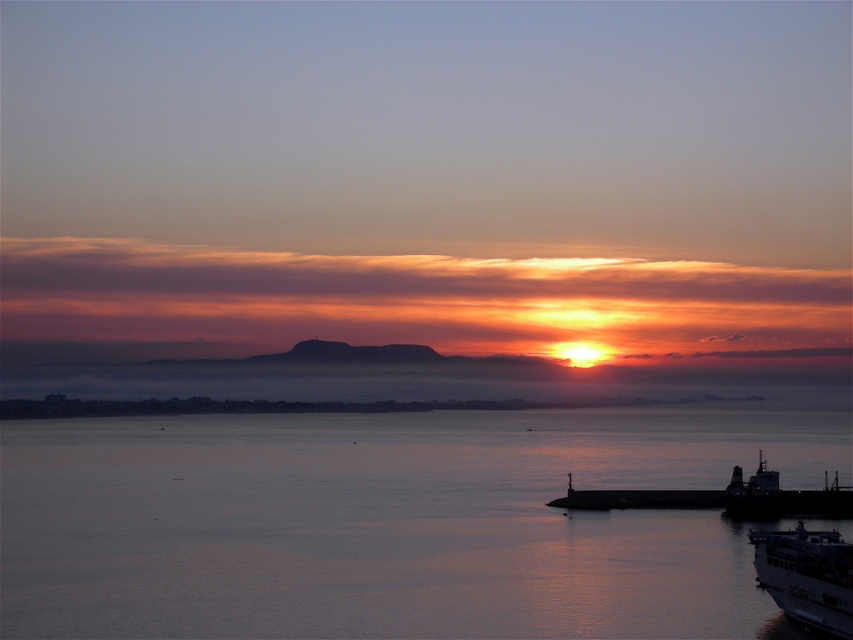
Between point (815, 616) and point (851, 493), which one is positioned behind?

The point (851, 493) is more distant.

Does white glossy boat at lower right appear over silvery metallic boat at lower right?

Correct, white glossy boat at lower right is located above silvery metallic boat at lower right.

Identify the location of white glossy boat at lower right. (805, 577).

I want to click on white glossy boat at lower right, so click(805, 577).

Between silvery metallic boat at lower right and metallic gray ship at lower right, which one is positioned higher?

Positioned higher is silvery metallic boat at lower right.

Which is in front, point (798, 490) or point (795, 492)?

Point (795, 492) is in front.

Find the location of a particular element. The height and width of the screenshot is (640, 853). silvery metallic boat at lower right is located at coordinates (724, 497).

Is white glossy boat at lower right taller than metallic gray ship at lower right?

No, white glossy boat at lower right is not taller than metallic gray ship at lower right.

Can you confirm if white glossy boat at lower right is positioned to the left of metallic gray ship at lower right?

Correct, you'll find white glossy boat at lower right to the left of metallic gray ship at lower right.

Between point (757, 576) and point (779, 499), which one is positioned behind?

The point (779, 499) is behind.

Locate an element on the screen. The width and height of the screenshot is (853, 640). white glossy boat at lower right is located at coordinates (805, 577).